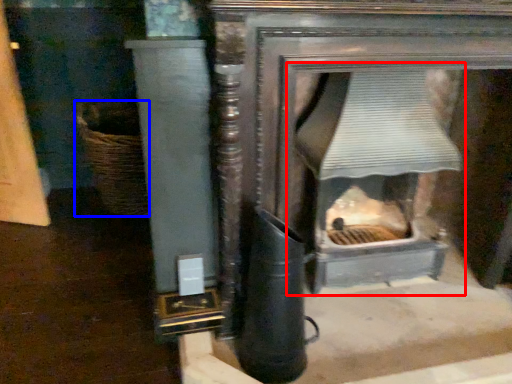
Question: Which point is closer to the camera, fireplace (highlighted by a red box) or basket (highlighted by a blue box)?

Choices:
 (A) fireplace
 (B) basket

Answer: (A)